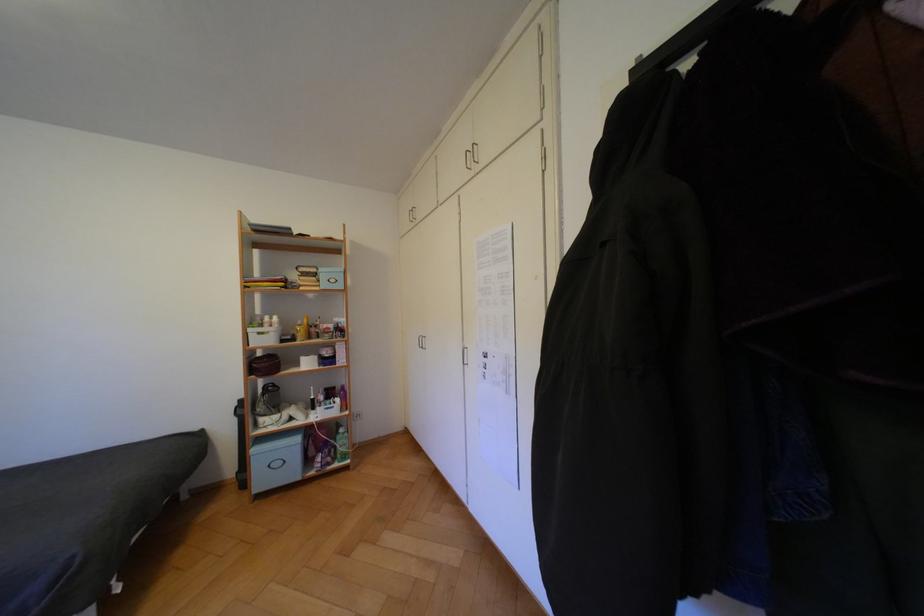
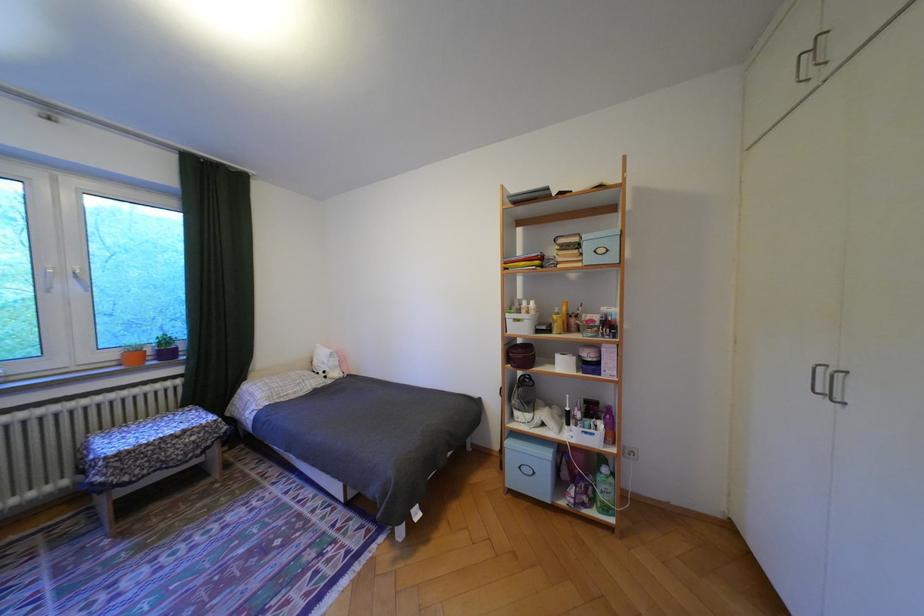
Where in the second image is the point corresponding to (x=310, y=363) from the first image?

(564, 362)